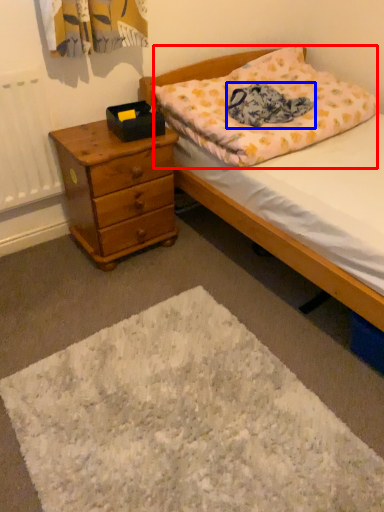
Question: Which point is closer to the camera, pillow (highlighted by a red box) or blanket (highlighted by a blue box)?

Choices:
 (A) pillow
 (B) blanket

Answer: (A)